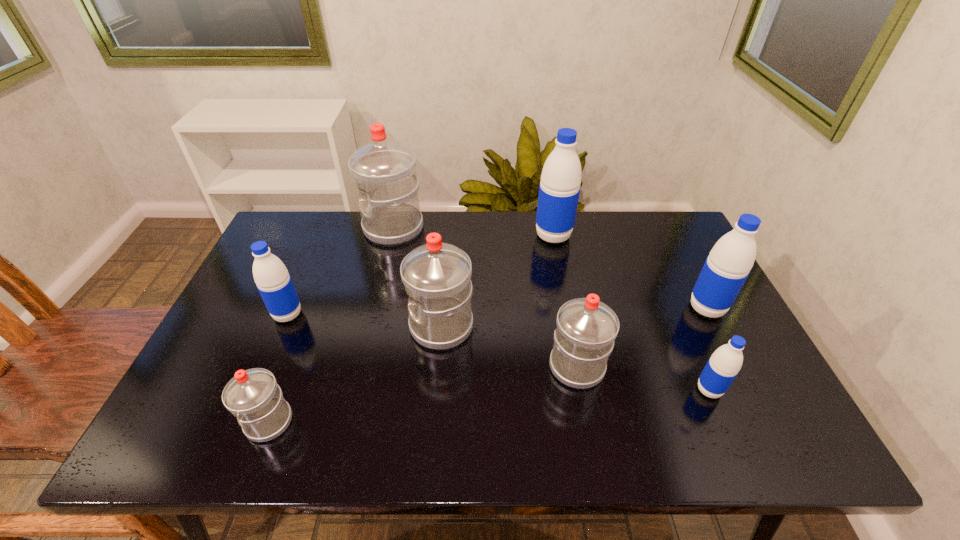
The image size is (960, 540). I want to click on free space between the second biggest blue water bottle and the smallest white water bottle, so click(x=488, y=365).

Identify the location of free space between the nearest white water bottle and the biggest white water bottle. This screenshot has width=960, height=540. (331, 325).

Select which object appears as the second closest to the leftmost white water bottle. Please provide its 2D coordinates. Your answer should be formatted as a tuple, i.e. [(x, y)], where the tuple contains the x and y coordinates of a point satisfying the conditions above.

[(437, 276)]

The image size is (960, 540). Identify the location of object that is the fifth nearest to the second white water bottle from left to right. (253, 396).

Select which water bottle appears as the fourth closest to the smallest white water bottle. Please provide its 2D coordinates. Your answer should be formatted as a tuple, i.e. [(x, y)], where the tuple contains the x and y coordinates of a point satisfying the conditions above.

[(586, 328)]

Find the location of a particular element. Image resolution: width=960 pixels, height=540 pixels. the seventh closest water bottle to the fifth water bottle from right to left is located at coordinates (728, 265).

The image size is (960, 540). I want to click on blue water bottle object that ranks as the fourth closest to the third biggest white water bottle, so tap(272, 279).

Point out which blue water bottle is positioned as the second nearest to the smallest white water bottle. Please provide its 2D coordinates. Your answer should be formatted as a tuple, i.e. [(x, y)], where the tuple contains the x and y coordinates of a point satisfying the conditions above.

[(559, 189)]

Where is `white water bottle that is the third closest to the rightmost object`? white water bottle that is the third closest to the rightmost object is located at coordinates (384, 171).

Find the location of a particular element. white water bottle identified as the closest to the third biggest white water bottle is located at coordinates (437, 276).